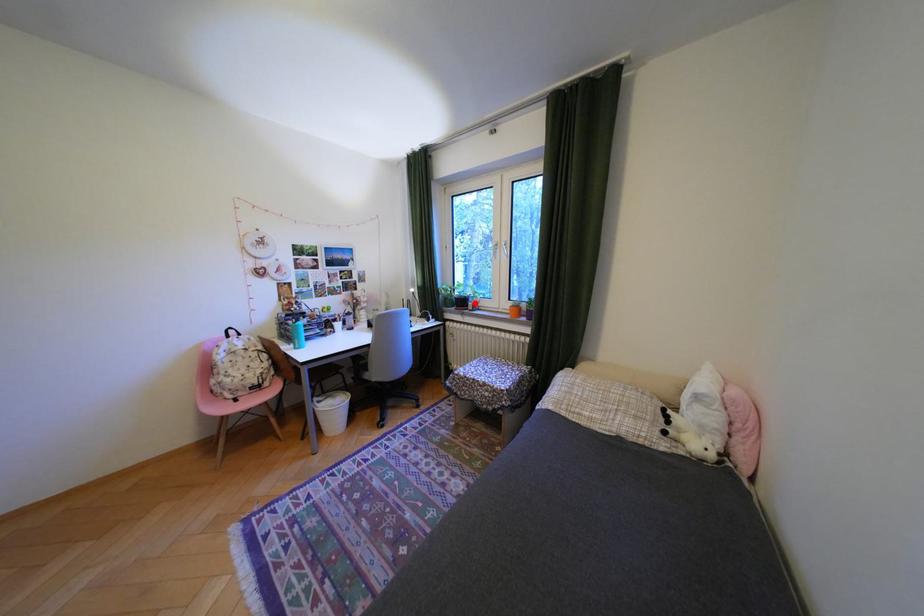
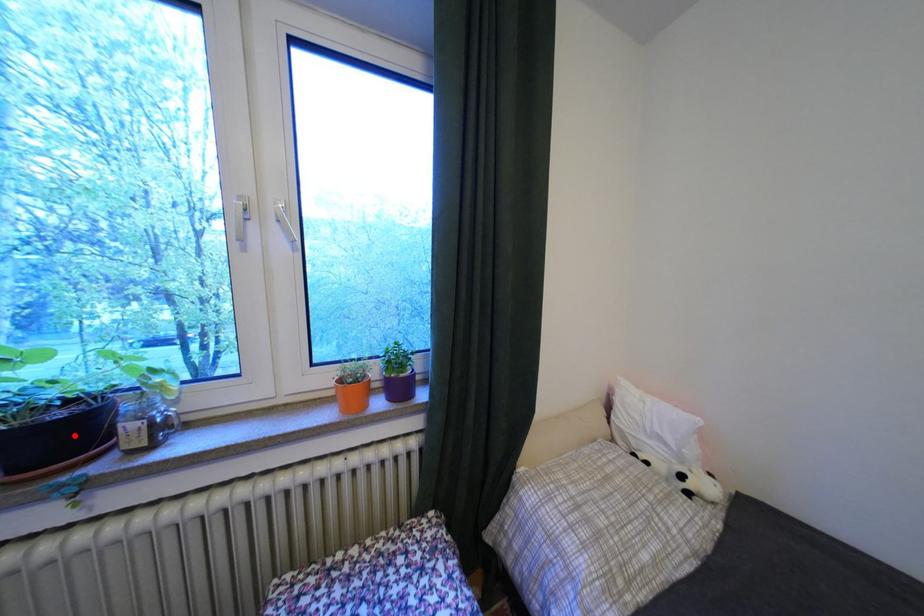
I am providing you with two images of the same scene from different viewpoints. A red point is marked on the first image and another point is marked on the second image. Are the points marked in image1 and image2 representing the same 3D position?

Yes